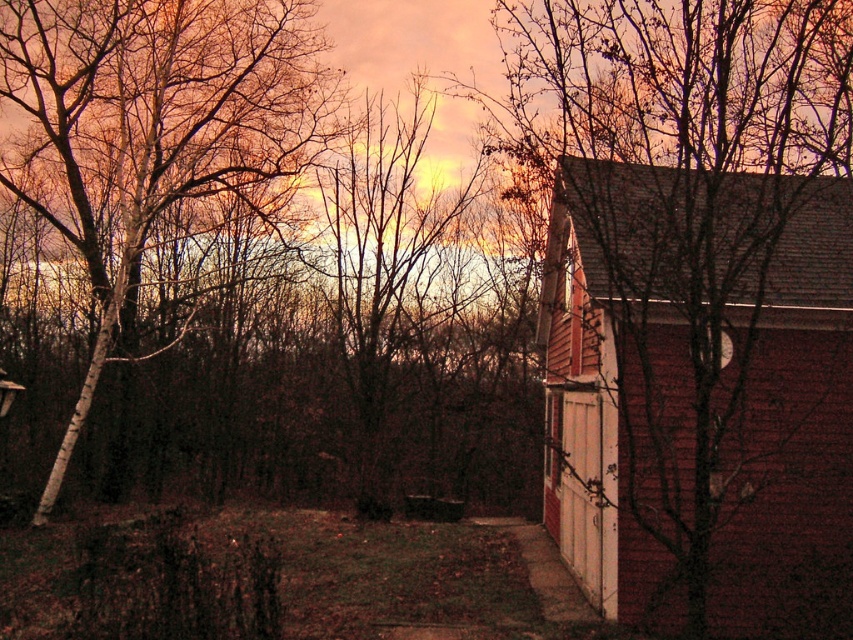
You are standing at the point with coordinates point (784,556). You want to walk to the point with coordinates point (263,102). Which direction should you walk to reach your destination?

To reach point (263,102) from point (784,556), you should walk towards the lower left direction since point (263,102) is behind point (784,556).

You are standing in the middle of the grassy area and want to walk towards the brick siding house at right. Which direction should you walk to avoid the smooth white tree at left?

The brick siding house at right is located below the smooth white tree at left, so to avoid the smooth white tree at left, you should walk towards the right side of the image, away from the smooth white tree at left.